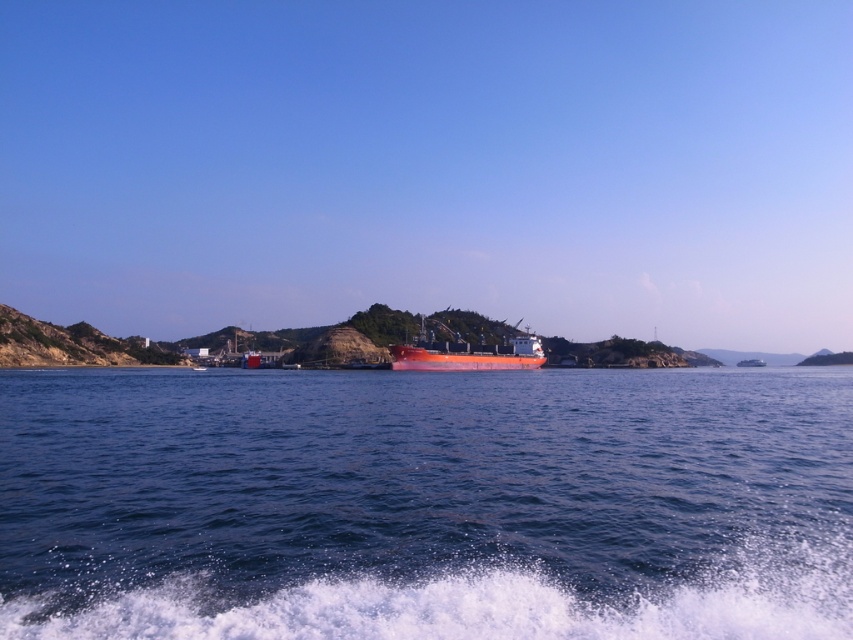
Question: Which object is farther from the camera taking this photo?

Choices:
 (A) blue water at center
 (B) matte orange ship at center

Answer: (B)

Question: Can you confirm if blue water at center is positioned below matte orange ship at center?

Choices:
 (A) yes
 (B) no

Answer: (A)

Question: Can you confirm if blue water at center is positioned below matte orange ship at center?

Choices:
 (A) yes
 (B) no

Answer: (A)

Question: Which point is closer to the camera taking this photo?

Choices:
 (A) (396, 368)
 (B) (370, 467)

Answer: (B)

Question: Does blue water at center have a smaller size compared to matte orange ship at center?

Choices:
 (A) yes
 (B) no

Answer: (A)